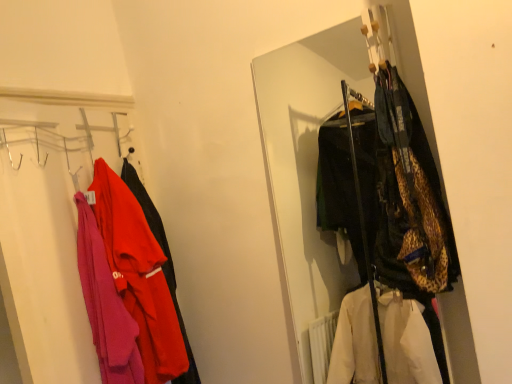
What do you see at coordinates (306, 164) in the screenshot? I see `leopard print jacket at center, arranged as the 2th closet when viewed from the left` at bounding box center [306, 164].

Measure the distance between point (74, 170) and camera.

Point (74, 170) is 4.48 feet from camera.

Locate an element on the screen. This screenshot has width=512, height=384. leopard print jacket at center, which ranks as the first closet in right-to-left order is located at coordinates (306, 164).

Considering the relative positions of matte red jacket at left and matte pink sweater at left, which is the second closet in right-to-left order, in the image provided, is matte red jacket at left behind matte pink sweater at left, which is the second closet in right-to-left order,?

Yes, it is behind matte pink sweater at left, which is the second closet in right-to-left order.

Identify the location of jacket on the right of matte pink sweater at left, marked as the 1th closet in a left-to-right arrangement. The width and height of the screenshot is (512, 384). (139, 275).

From a real-world perspective, is matte red jacket at left above or below matte pink sweater at left, which is the second closet in right-to-left order?

In terms of real-world spatial position, matte red jacket at left is below matte pink sweater at left, which is the second closet in right-to-left order.

Does matte red jacket at left contain leopard print jacket at center, which ranks as the first closet in right-to-left order?

No, leopard print jacket at center, which ranks as the first closet in right-to-left order, is located outside of matte red jacket at left.

Considering the positions of point (149, 379) and point (270, 68), is point (149, 379) closer or farther from the camera than point (270, 68)?

Point (149, 379) appears to be closer to the viewer than point (270, 68).

From a real-world perspective, is matte red jacket at left on leopard print jacket at center, which ranks as the first closet in right-to-left order?

No.

Between matte red jacket at left and leopard print jacket at center, which ranks as the first closet in right-to-left order, which one has smaller size?

matte red jacket at left is smaller.

Considering the sizes of objects matte pink sweater at left, marked as the 1th closet in a left-to-right arrangement, and matte red jacket at left in the image provided, who is shorter, matte pink sweater at left, marked as the 1th closet in a left-to-right arrangement, or matte red jacket at left?

Standing shorter between the two is matte red jacket at left.

Is there a large distance between matte pink sweater at left, marked as the 1th closet in a left-to-right arrangement, and matte red jacket at left?

matte pink sweater at left, marked as the 1th closet in a left-to-right arrangement, is near matte red jacket at left, not far away.

In the image, is matte pink sweater at left, which is the second closet in right-to-left order, positioned in front of or behind matte red jacket at left?

matte pink sweater at left, which is the second closet in right-to-left order, is in front of matte red jacket at left.

Measure the distance between matte pink sweater at left, marked as the 1th closet in a left-to-right arrangement, and matte red jacket at left.

The distance of matte pink sweater at left, marked as the 1th closet in a left-to-right arrangement, from matte red jacket at left is 7.87 centimeters.

From the image's perspective, is leopard print jacket at center, which ranks as the first closet in right-to-left order, located above or below matte red jacket at left?

From the image's perspective, leopard print jacket at center, which ranks as the first closet in right-to-left order, appears above matte red jacket at left.

From a real-world perspective, who is located lower, leopard print jacket at center, which ranks as the first closet in right-to-left order, or matte red jacket at left?

From a 3D spatial view, matte red jacket at left is below.

Does leopard print jacket at center, which ranks as the first closet in right-to-left order, have a lesser width compared to matte red jacket at left?

No, leopard print jacket at center, which ranks as the first closet in right-to-left order, is not thinner than matte red jacket at left.

Between point (302, 210) and point (140, 277), which one is positioned in front?

The point (140, 277) is in front.

Considering the positions of objects matte pink sweater at left, marked as the 1th closet in a left-to-right arrangement, and leopard print jacket at center, which ranks as the first closet in right-to-left order, in the image provided, who is more to the right, matte pink sweater at left, marked as the 1th closet in a left-to-right arrangement, or leopard print jacket at center, which ranks as the first closet in right-to-left order,?

From the viewer's perspective, leopard print jacket at center, which ranks as the first closet in right-to-left order, appears more on the right side.

Find the location of a particular element. The image size is (512, 384). closet above the matte pink sweater at left, which is the second closet in right-to-left order (from a real-world perspective) is located at coordinates (306, 164).

From the image's perspective, which one is positioned lower, matte pink sweater at left, marked as the 1th closet in a left-to-right arrangement, or leopard print jacket at center, arranged as the 2th closet when viewed from the left?

matte pink sweater at left, marked as the 1th closet in a left-to-right arrangement, from the image's perspective.

Does matte pink sweater at left, marked as the 1th closet in a left-to-right arrangement, have a greater width compared to leopard print jacket at center, which ranks as the first closet in right-to-left order?

No.

Is leopard print jacket at center, which ranks as the first closet in right-to-left order, wider or thinner than matte pink sweater at left, marked as the 1th closet in a left-to-right arrangement?

Considering their sizes, leopard print jacket at center, which ranks as the first closet in right-to-left order, looks broader than matte pink sweater at left, marked as the 1th closet in a left-to-right arrangement.

From the image's perspective, would you say leopard print jacket at center, arranged as the 2th closet when viewed from the left, is positioned over matte pink sweater at left, which is the second closet in right-to-left order?

Yes.

Is leopard print jacket at center, arranged as the 2th closet when viewed from the left, to the left or to the right of matte pink sweater at left, which is the second closet in right-to-left order, in the image?

Clearly, leopard print jacket at center, arranged as the 2th closet when viewed from the left, is on the right of matte pink sweater at left, which is the second closet in right-to-left order, in the image.

Is leopard print jacket at center, arranged as the 2th closet when viewed from the left, facing towards matte pink sweater at left, marked as the 1th closet in a left-to-right arrangement?

No.

Locate an element on the screen. closet below the matte red jacket at left (from the image's perspective) is located at coordinates (73, 247).

Which closet is the 2nd one when counting from the front of the matte red jacket at left? Please provide its 2D coordinates.

[(306, 164)]

Estimate the real-world distances between objects in this image. Which object is closer to matte red jacket at left, matte pink sweater at left, marked as the 1th closet in a left-to-right arrangement, or leopard print jacket at center, arranged as the 2th closet when viewed from the left?

The object closer to matte red jacket at left is matte pink sweater at left, marked as the 1th closet in a left-to-right arrangement.

Based on the photo, which object lies further to the anchor point matte pink sweater at left, which is the second closet in right-to-left order, matte red jacket at left or leopard print jacket at center, which ranks as the first closet in right-to-left order?

Based on the image, leopard print jacket at center, which ranks as the first closet in right-to-left order, appears to be further to matte pink sweater at left, which is the second closet in right-to-left order.

Considering their positions, is leopard print jacket at center, which ranks as the first closet in right-to-left order, positioned closer to matte red jacket at left than matte pink sweater at left, marked as the 1th closet in a left-to-right arrangement?

matte pink sweater at left, marked as the 1th closet in a left-to-right arrangement, is positioned closer to the anchor matte red jacket at left.

Looking at this image, from the image, which object appears to be nearer to leopard print jacket at center, which ranks as the first closet in right-to-left order, matte red jacket at left or matte pink sweater at left, marked as the 1th closet in a left-to-right arrangement?

Based on the image, matte pink sweater at left, marked as the 1th closet in a left-to-right arrangement, appears to be nearer to leopard print jacket at center, which ranks as the first closet in right-to-left order.

From the image, which object appears to be farther from matte pink sweater at left, marked as the 1th closet in a left-to-right arrangement, leopard print jacket at center, which ranks as the first closet in right-to-left order, or matte red jacket at left?

leopard print jacket at center, which ranks as the first closet in right-to-left order, is positioned further to the anchor matte pink sweater at left, marked as the 1th closet in a left-to-right arrangement.

When comparing their distances from leopard print jacket at center, arranged as the 2th closet when viewed from the left, does matte pink sweater at left, which is the second closet in right-to-left order, or matte red jacket at left seem further?

matte red jacket at left lies further to leopard print jacket at center, arranged as the 2th closet when viewed from the left, than the other object.

Locate an element on the screen. The image size is (512, 384). jacket between matte pink sweater at left, which is the second closet in right-to-left order, and leopard print jacket at center, arranged as the 2th closet when viewed from the left, from left to right is located at coordinates (139, 275).